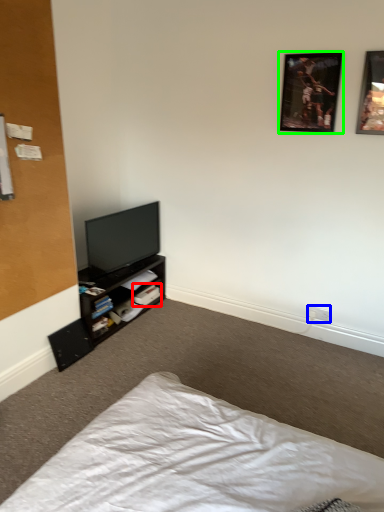
Question: Which object is the closest to the book (highlighted by a red box)? Choose among these: electric outlet (highlighted by a blue box) or picture frame (highlighted by a green box).

Choices:
 (A) electric outlet
 (B) picture frame

Answer: (A)